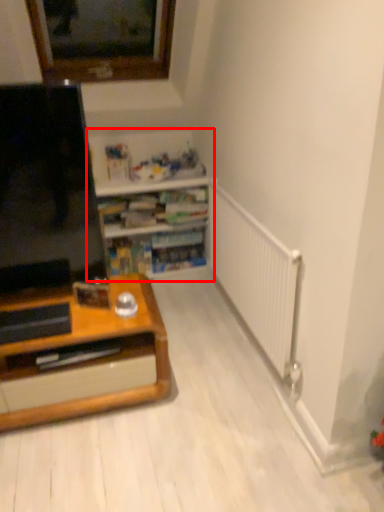
Question: From the image's perspective, what is the correct spatial positioning of shelf (annotated by the red box) in reference to screen?

Choices:
 (A) below
 (B) above

Answer: (A)